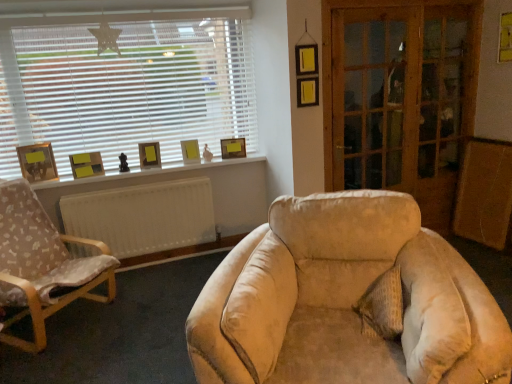
Locate an element on the screen. This screenshot has height=384, width=512. vacant area situated below white blinds at upper left (from a real-world perspective) is located at coordinates (157, 163).